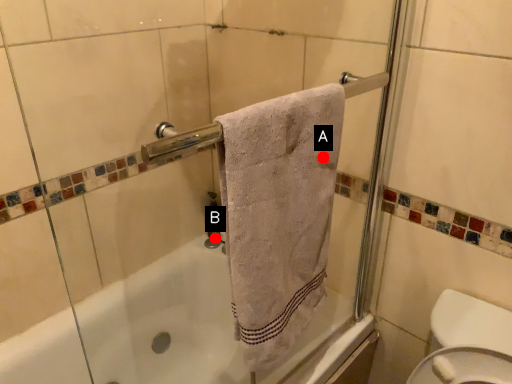
Question: Two points are circled on the image, labeled by A and B beside each circle. Which point is farther from the camera taking this photo?

Choices:
 (A) A is further
 (B) B is further

Answer: (B)